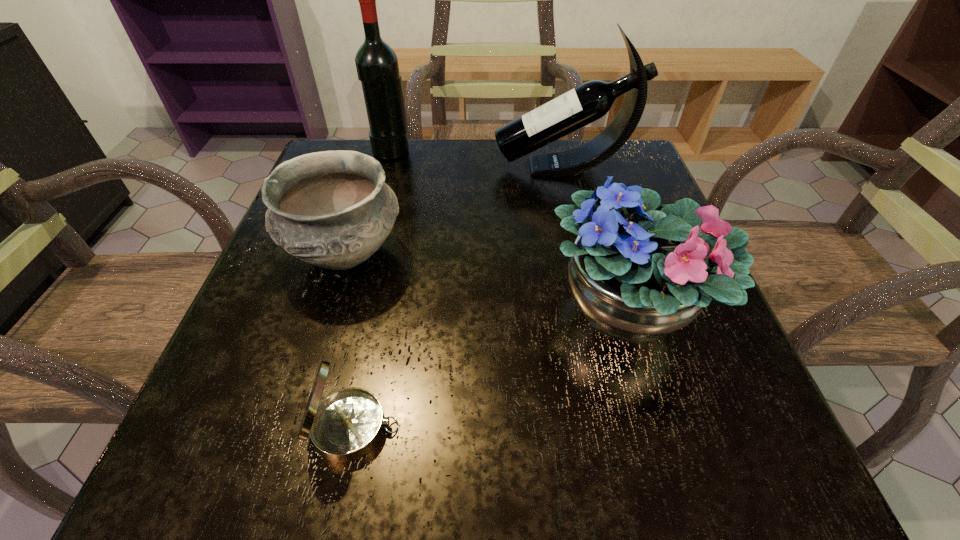
Locate an element on the screen. This screenshot has width=960, height=540. blank space located on the stand of the right wine bottle is located at coordinates (384, 167).

You are a GUI agent. You are given a task and a screenshot of the screen. Output one action in this format:
    pyautogui.click(x=<x>, y=<y>)
    Task: Click on the vacant space situated 0.370m on the left of the third shortest object
    
    Given the screenshot: What is the action you would take?
    pyautogui.click(x=319, y=308)

Find the location of a particular element. The width and height of the screenshot is (960, 540). vacant space located on the front of the fourth tallest object is located at coordinates coord(316,353).

Locate an element on the screen. The height and width of the screenshot is (540, 960). vacant space located with the dial facing the shortest object is located at coordinates (668, 428).

The width and height of the screenshot is (960, 540). I want to click on object that is positioned at the near edge, so click(345, 426).

The height and width of the screenshot is (540, 960). In order to click on wine bottle situated at the left edge in this screenshot , I will do `click(377, 67)`.

Locate an element on the screen. Image resolution: width=960 pixels, height=540 pixels. pottery located at the left edge is located at coordinates (332, 209).

Find the location of a particular element. The width and height of the screenshot is (960, 540). compass that is at the left edge is located at coordinates (345, 426).

The image size is (960, 540). In order to click on wine bottle that is at the right edge in this screenshot , I will do `click(590, 101)`.

Where is `bouquet that is at the right edge`? bouquet that is at the right edge is located at coordinates (639, 271).